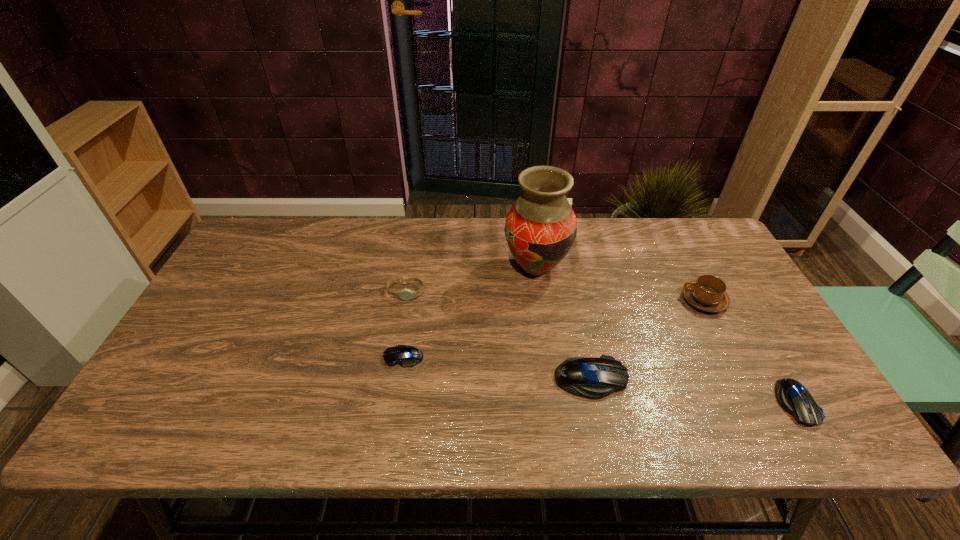
Identify the location of vacant region between the vase and the watch. Image resolution: width=960 pixels, height=540 pixels. (471, 280).

Locate an element on the screen. Image resolution: width=960 pixels, height=540 pixels. free space between the tallest object and the watch is located at coordinates (471, 280).

The width and height of the screenshot is (960, 540). Find the location of `free space between the second computer mouse from left to right and the shortest object`. free space between the second computer mouse from left to right and the shortest object is located at coordinates (497, 368).

Locate an element on the screen. This screenshot has height=540, width=960. free space between the leftmost computer mouse and the second tallest object is located at coordinates (554, 328).

Where is `vacant space that is in between the watch and the shortest object`? The width and height of the screenshot is (960, 540). vacant space that is in between the watch and the shortest object is located at coordinates (405, 325).

Locate which object is the closest to the second tallest object. Please provide its 2D coordinates. Your answer should be formatted as a tuple, i.e. [(x, y)], where the tuple contains the x and y coordinates of a point satisfying the conditions above.

[(792, 396)]

Identify which object is the nearest to the leftmost computer mouse. Please provide its 2D coordinates. Your answer should be formatted as a tuple, i.e. [(x, y)], where the tuple contains the x and y coordinates of a point satisfying the conditions above.

[(405, 294)]

The image size is (960, 540). What are the coordinates of `computer mouse that is the closest to the fifth tallest object` in the screenshot? It's located at (594, 378).

Image resolution: width=960 pixels, height=540 pixels. In order to click on the closest computer mouse relative to the watch in this screenshot , I will do `click(406, 356)`.